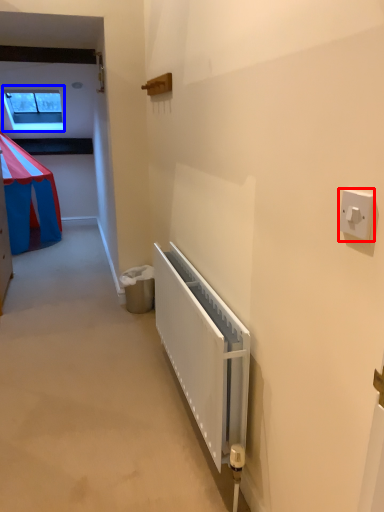
Question: Which object is closer to the camera taking this photo, light switch (highlighted by a red box) or window (highlighted by a blue box)?

Choices:
 (A) light switch
 (B) window

Answer: (A)